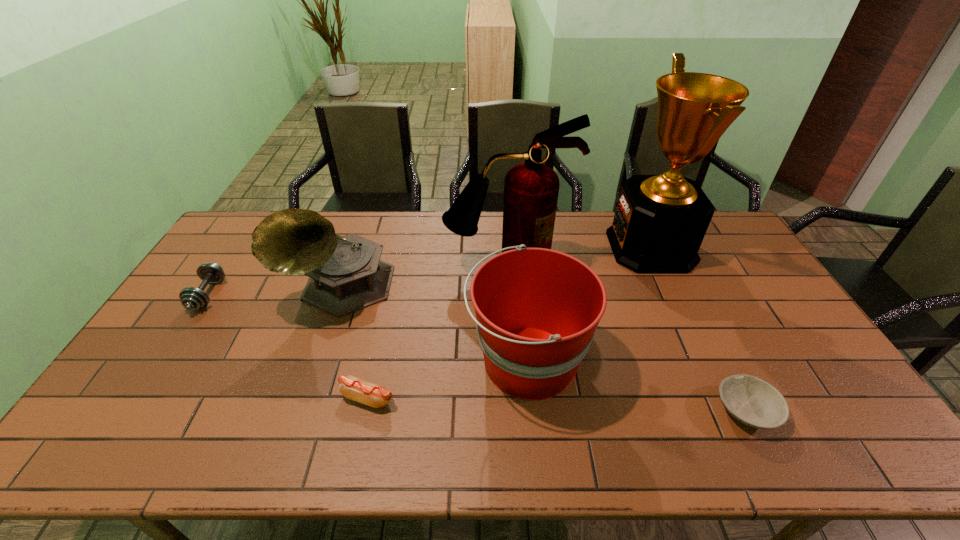
Locate an element on the screen. vacant region located on the front of the trophy cup with the label is located at coordinates (527, 247).

Where is `vacant space situated 0.190m at the nozzle of the fire extinguisher`? This screenshot has height=540, width=960. vacant space situated 0.190m at the nozzle of the fire extinguisher is located at coordinates (512, 327).

I want to click on vacant space positioned 0.300m on the horn direction of the phonograph record, so click(296, 421).

Where is `vacant space located on the front of the bucket`? The width and height of the screenshot is (960, 540). vacant space located on the front of the bucket is located at coordinates (536, 455).

You are a GUI agent. You are given a task and a screenshot of the screen. Output one action in this format:
    pyautogui.click(x=<x>, y=<y>)
    Task: Click on the vacant space located on the right of the leftmost object
    
    Given the screenshot: What is the action you would take?
    pyautogui.click(x=262, y=295)

The height and width of the screenshot is (540, 960). I want to click on free spot located 0.290m on the back of the sausage, so click(388, 305).

In order to click on free space located on the left of the shortest object in this screenshot , I will do `click(684, 410)`.

The height and width of the screenshot is (540, 960). In order to click on object positioned at the far edge in this screenshot , I will do `click(660, 221)`.

At what (x,y) coordinates should I click in order to perform the action: click on object present at the near edge. Please return your answer as a coordinate pair (x, y). Looking at the image, I should click on (754, 402).

At what (x,y) coordinates should I click in order to perform the action: click on object positioned at the left edge. Please return your answer as a coordinate pair (x, y). Image resolution: width=960 pixels, height=540 pixels. Looking at the image, I should click on (192, 298).